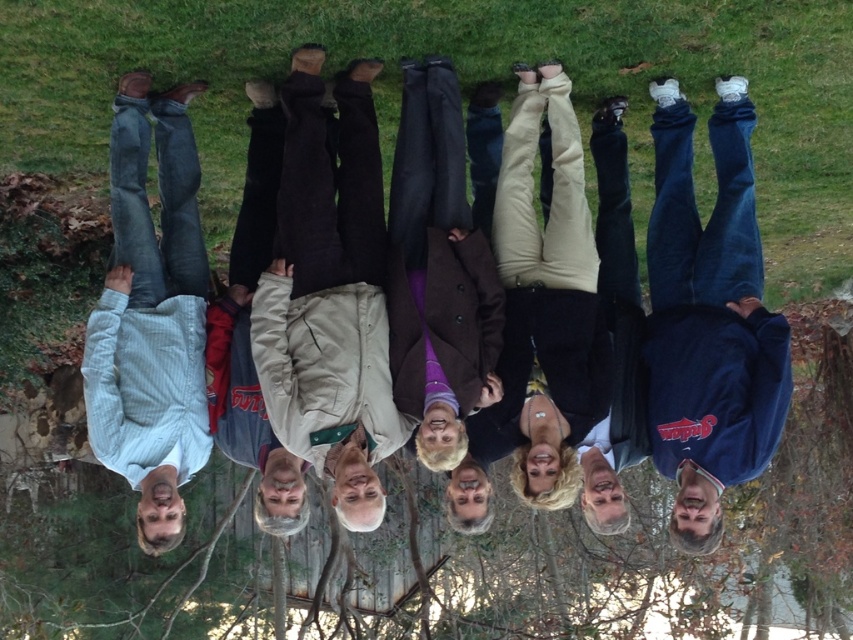
Between point (840, 13) and point (738, 276), which one is positioned in front?

Point (738, 276)

Consider the image. Which is below, green grass at center or blue fleece jacket at lower right?

Positioned lower is blue fleece jacket at lower right.

You are a GUI agent. You are given a task and a screenshot of the screen. Output one action in this format:
    pyautogui.click(x=<x>, y=<y>)
    Task: Click on the green grass at center
    The image size is (853, 640).
    Given the screenshot: What is the action you would take?
    pyautogui.click(x=465, y=88)

Identify the location of green grass at center. (465, 88).